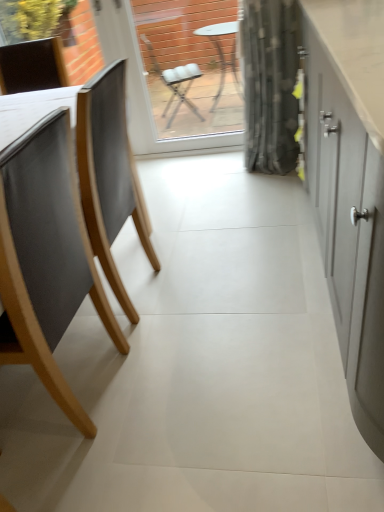
In order to click on unoccupied region to the right of matte wood chair at left in this screenshot , I will do `click(195, 385)`.